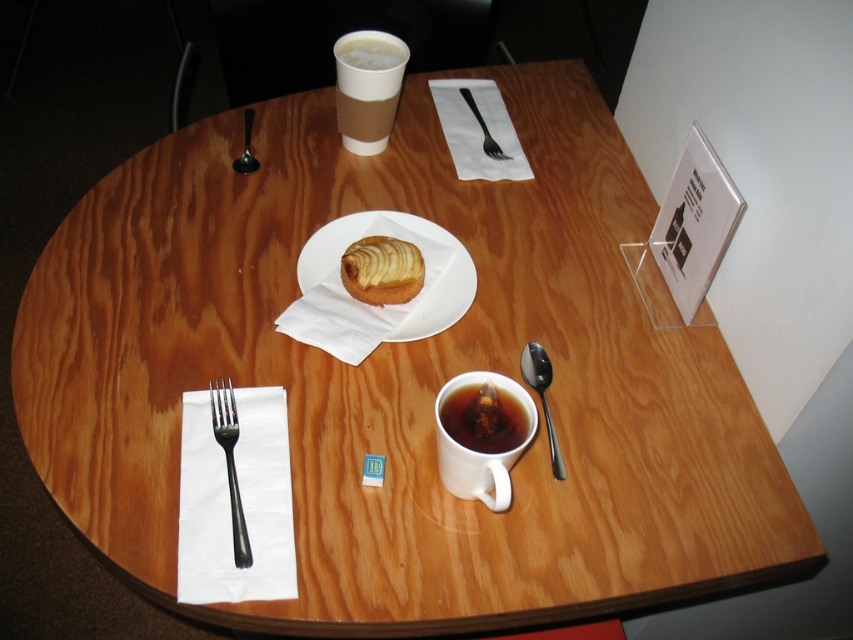
Question: Is black matte cup of tea at center below satin silver spoon at right?

Choices:
 (A) no
 (B) yes

Answer: (A)

Question: Does white paper plate at center appear on the left side of white ceramic mug at center?

Choices:
 (A) yes
 (B) no

Answer: (A)

Question: Which is nearer to the matte brown cup at upper center?

Choices:
 (A) white ceramic mug at center
 (B) black matte cup of tea at center

Answer: (A)

Question: Is white paper plate at center above matte brown cup at upper center?

Choices:
 (A) yes
 (B) no

Answer: (B)

Question: Which point appears closest to the camera in this image?

Choices:
 (A) (485, 426)
 (B) (345, 132)

Answer: (A)

Question: Which object is closer to the camera taking this photo?

Choices:
 (A) matte brown cup at upper center
 (B) silver metallic fork at left
 (C) black matte cup of tea at center

Answer: (C)